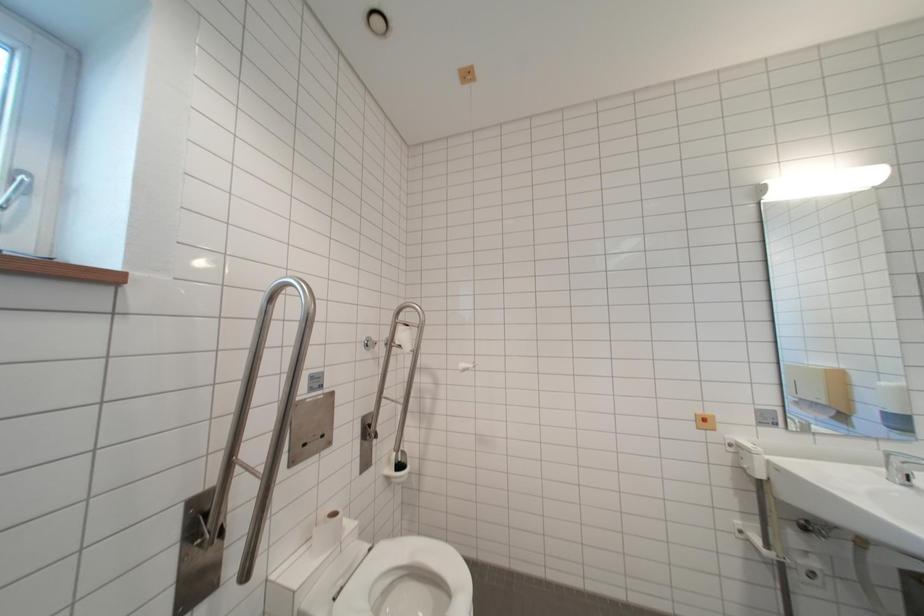
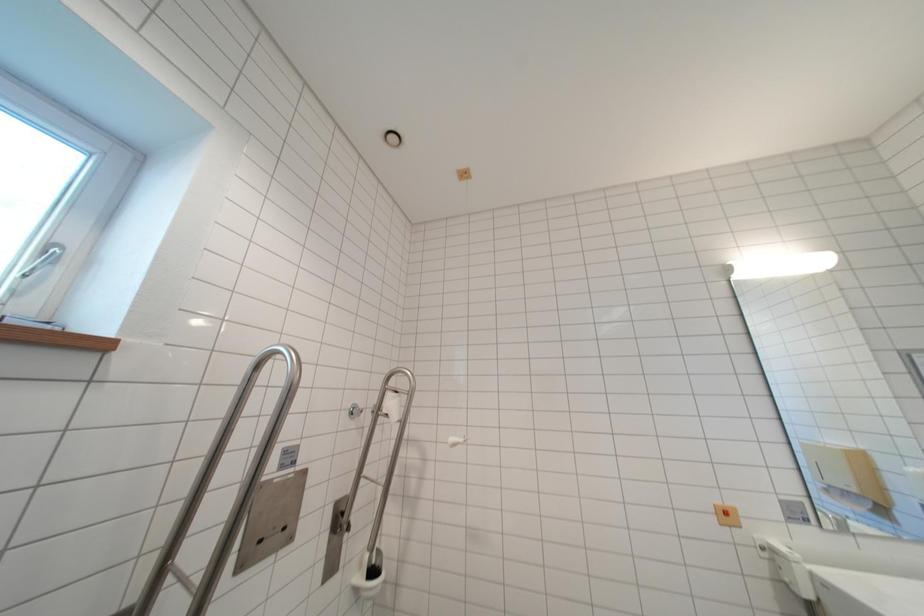
Question: How did the camera likely rotate?

Choices:
 (A) Left
 (B) Right
 (C) Up
 (D) Down

Answer: (C)